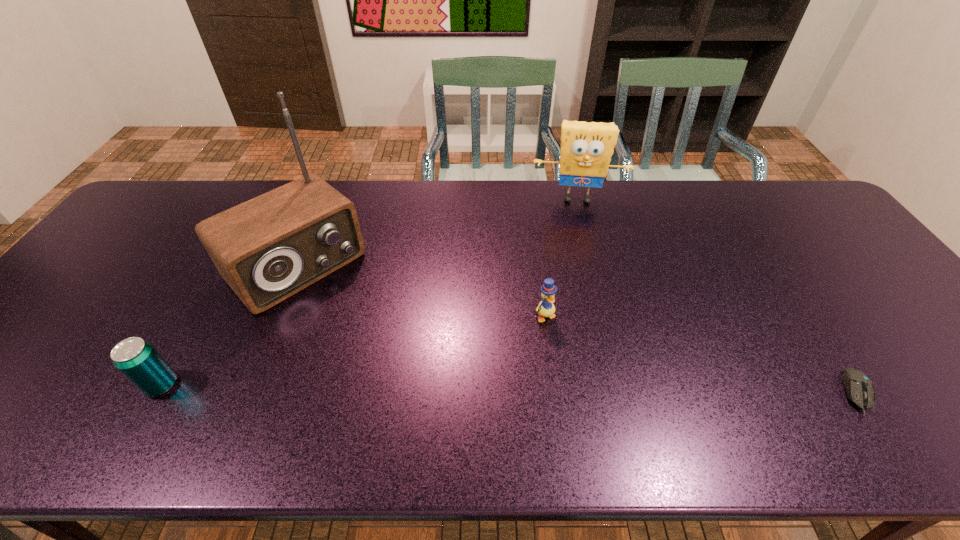
Where is `beer can`? beer can is located at coordinates (135, 358).

Where is `the shortest object`? The width and height of the screenshot is (960, 540). the shortest object is located at coordinates (859, 388).

The width and height of the screenshot is (960, 540). Find the location of `the rightmost object`. the rightmost object is located at coordinates (859, 388).

Find the location of `the farthest object`. the farthest object is located at coordinates (586, 148).

The image size is (960, 540). I want to click on the fourth shortest object, so click(x=586, y=148).

This screenshot has height=540, width=960. I want to click on duckling, so click(545, 308).

Where is `radio receiver`? radio receiver is located at coordinates (267, 249).

At what (x,y) coordinates should I click in order to perform the action: click on vacant space located 0.400m on the right of the beer can. Please return your answer as a coordinate pair (x, y). This screenshot has height=540, width=960. Looking at the image, I should click on (357, 385).

The image size is (960, 540). Identify the location of vacant space located 0.060m on the back of the shortest object. (828, 348).

I want to click on blank area located 0.380m on the face of the farthest object, so point(579,299).